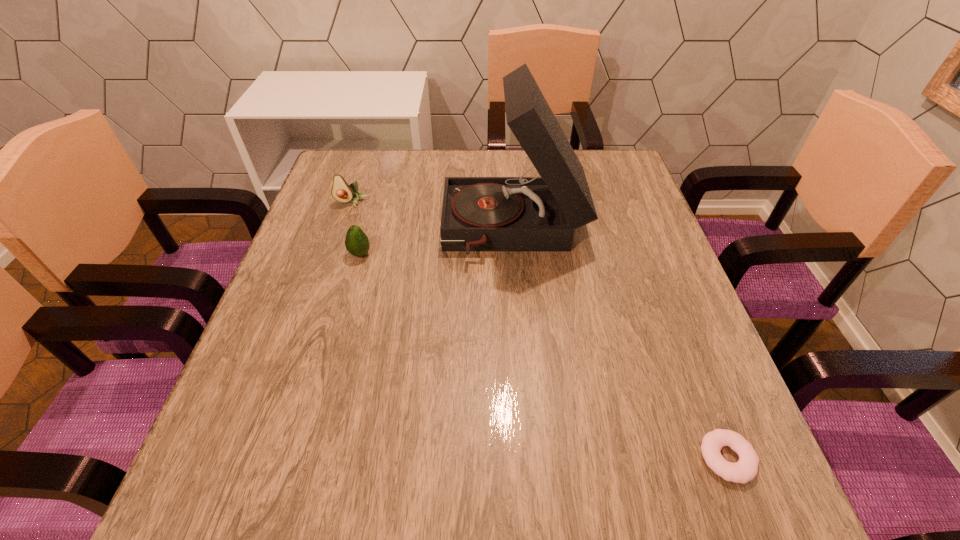
This screenshot has height=540, width=960. In order to click on empty space that is in between the second shortest object and the shortest object in this screenshot , I will do `click(543, 356)`.

You are a GUI agent. You are given a task and a screenshot of the screen. Output one action in this format:
    pyautogui.click(x=<x>, y=<y>)
    Task: Click on the vacant area that lies between the third object from left to right and the nearer avocado
    The width and height of the screenshot is (960, 540).
    Given the screenshot: What is the action you would take?
    pyautogui.click(x=437, y=242)

At what (x,y) coordinates should I click in order to perform the action: click on the third closest object to the shorter avocado. Please return your answer as a coordinate pair (x, y). Image resolution: width=960 pixels, height=540 pixels. Looking at the image, I should click on (746, 469).

Identify which object is the third nearest to the farther avocado. Please provide its 2D coordinates. Your answer should be formatted as a tuple, i.e. [(x, y)], where the tuple contains the x and y coordinates of a point satisfying the conditions above.

[(746, 469)]

Where is `free space that satisfies the following two spatial constraints: 1. on the seed side of the nearest object; 2. on the left side of the farther avocado`? This screenshot has height=540, width=960. free space that satisfies the following two spatial constraints: 1. on the seed side of the nearest object; 2. on the left side of the farther avocado is located at coordinates (266, 458).

This screenshot has height=540, width=960. What are the coordinates of `vacant space that satisfies the following two spatial constraints: 1. on the front-facing side of the tallest object; 2. on the right side of the doughnut` in the screenshot? It's located at (533, 458).

You are a GUI agent. You are given a task and a screenshot of the screen. Output one action in this format:
    pyautogui.click(x=<x>, y=<y>)
    Task: Click on the free space that satisfies the following two spatial constraints: 1. on the seed side of the farther avocado; 2. on the left side of the second shortest object
    The image size is (960, 540).
    Given the screenshot: What is the action you would take?
    pyautogui.click(x=334, y=254)

The image size is (960, 540). Identify the location of vacant area in the image that satisfies the following two spatial constraints: 1. on the front-facing side of the doughnut; 2. on the right side of the second object from right to left. 533,458.

I want to click on free space in the image that satisfies the following two spatial constraints: 1. on the seed side of the farther avocado; 2. on the right side of the doughnut, so pos(266,458).